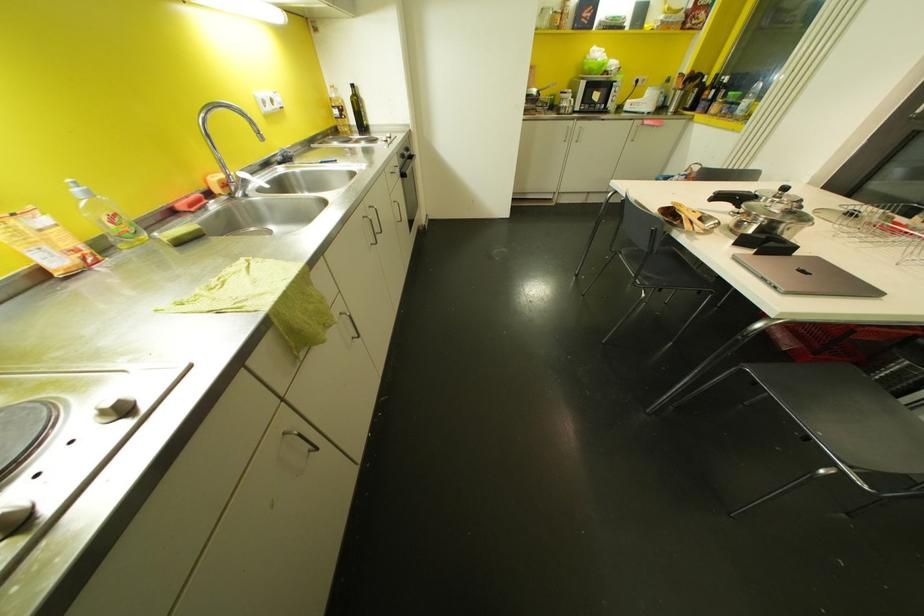
The height and width of the screenshot is (616, 924). What do you see at coordinates (174, 251) in the screenshot? I see `the green kitchen sponge` at bounding box center [174, 251].